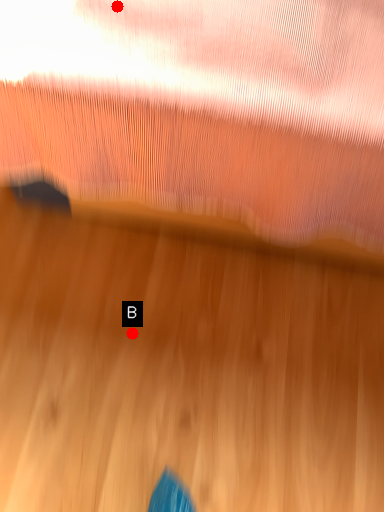
Question: Two points are circled on the image, labeled by A and B beside each circle. Which point appears closest to the camera in this image?

Choices:
 (A) A is closer
 (B) B is closer

Answer: (A)